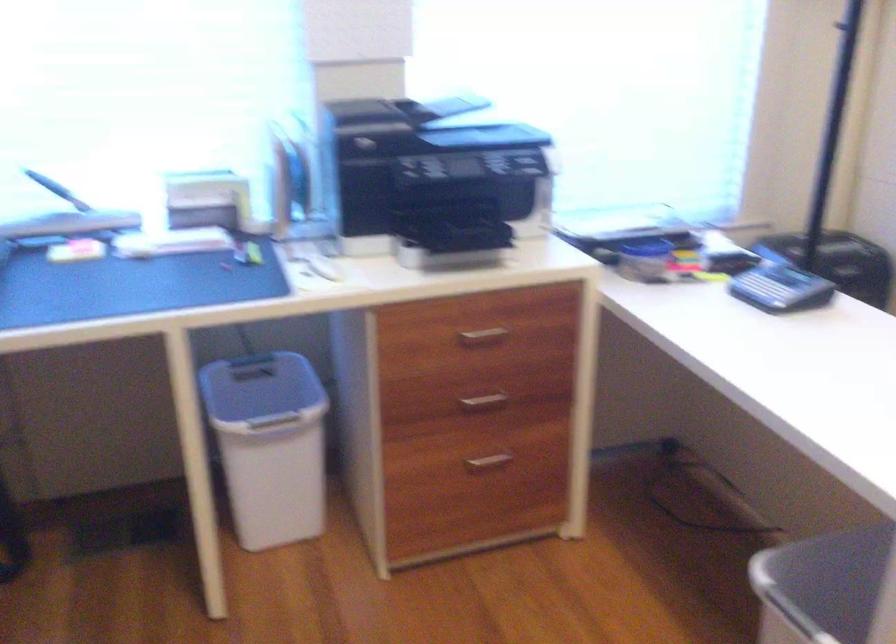
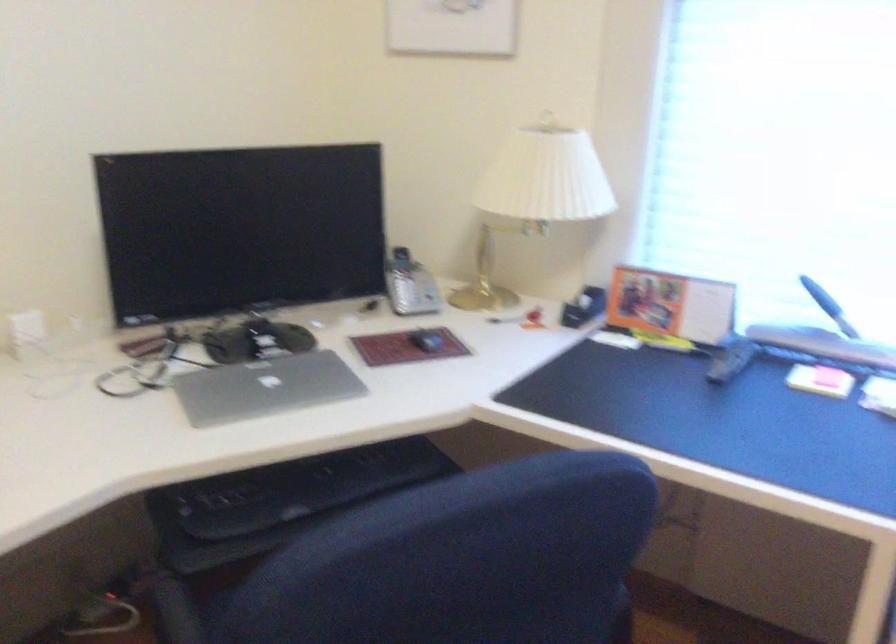
In the second image, find the point that corresponds to point (85, 245) in the first image.

(829, 377)